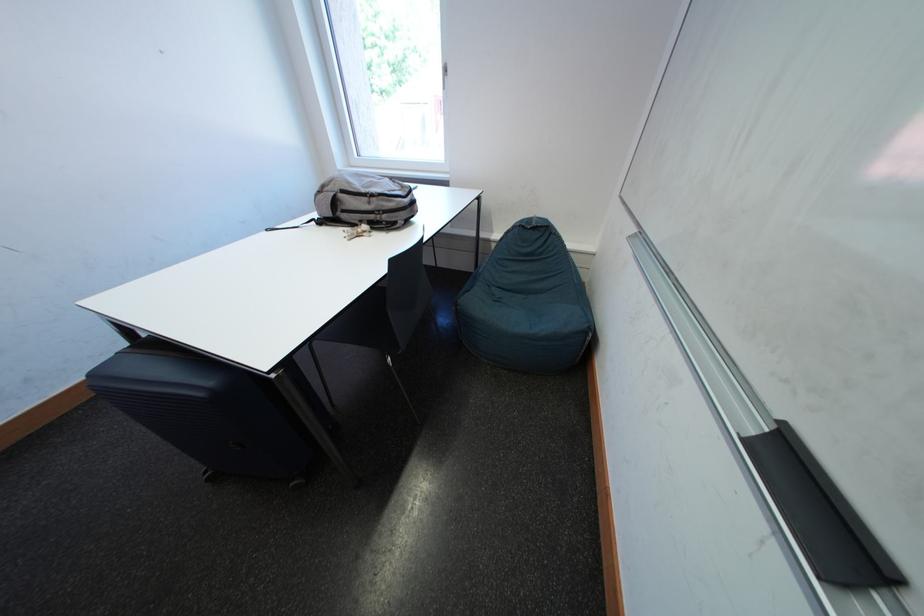
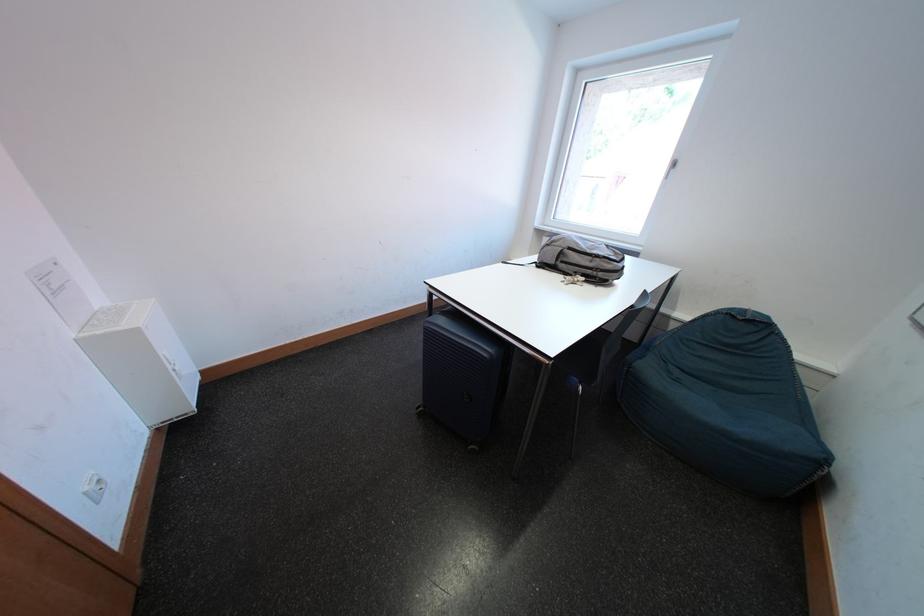
The point at (379, 207) is marked in the first image. Where is the corresponding point in the second image?

(601, 265)